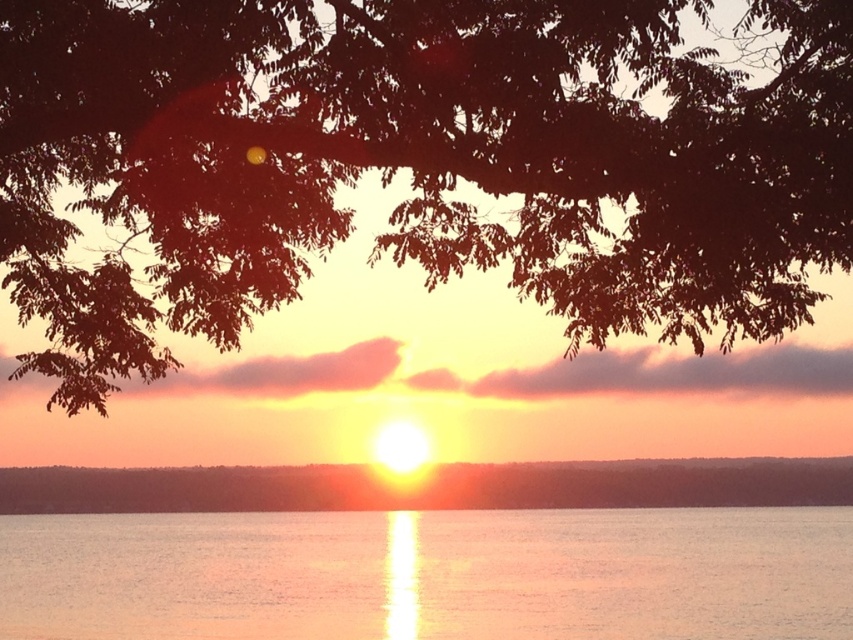
Question: Among these objects, which one is farthest from the camera?

Choices:
 (A) reflective silver water at center
 (B) dark brown leafy branches at upper center
 (C) smooth orange sky at center

Answer: (C)

Question: Which object is the closest to the reflective silver water at center?

Choices:
 (A) dark brown leafy branches at upper center
 (B) smooth orange sky at center

Answer: (B)

Question: Considering the real-world distances, which object is farthest from the smooth orange sky at center?

Choices:
 (A) dark brown leafy branches at upper center
 (B) reflective silver water at center

Answer: (A)

Question: Is the position of dark brown leafy branches at upper center more distant than that of reflective silver water at center?

Choices:
 (A) no
 (B) yes

Answer: (A)

Question: Can you confirm if dark brown leafy branches at upper center is smaller than smooth orange sky at center?

Choices:
 (A) no
 (B) yes

Answer: (A)

Question: Does dark brown leafy branches at upper center appear under reflective silver water at center?

Choices:
 (A) no
 (B) yes

Answer: (A)